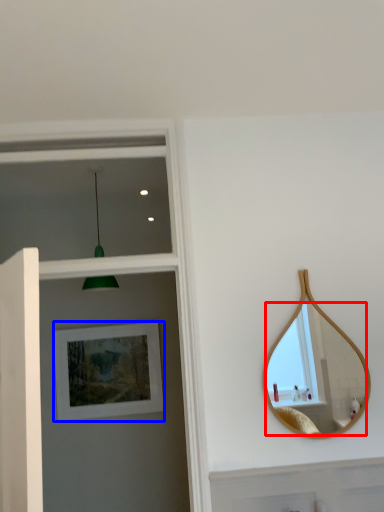
Question: Among these objects, which one is nearest to the camera, mirror (highlighted by a red box) or picture frame (highlighted by a blue box)?

Choices:
 (A) mirror
 (B) picture frame

Answer: (A)